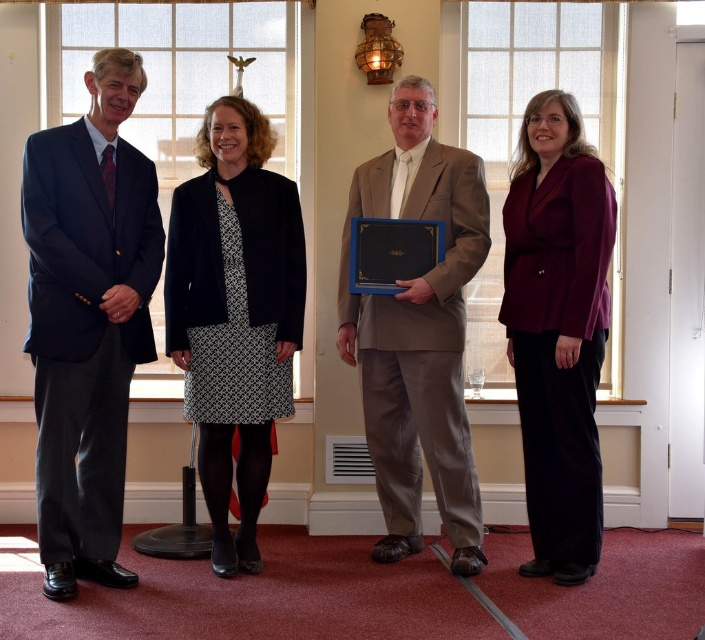
Question: Which of the following is the farthest from the observer?

Choices:
 (A) tan fabric suit at center
 (B) matte black suit at left

Answer: (A)

Question: Can you confirm if tan fabric suit at center is bigger than burgundy satin blazer at right?

Choices:
 (A) no
 (B) yes

Answer: (B)

Question: Can you confirm if black textured skirt at center is thinner than burgundy satin blazer at right?

Choices:
 (A) yes
 (B) no

Answer: (B)

Question: Which point is closer to the camera?

Choices:
 (A) matte black suit at left
 (B) tan fabric suit at center

Answer: (A)

Question: Is black textured skirt at center to the left of burgundy satin blazer at right from the viewer's perspective?

Choices:
 (A) yes
 (B) no

Answer: (A)

Question: Which point is farther to the camera?

Choices:
 (A) tan fabric suit at center
 (B) black textured skirt at center

Answer: (B)